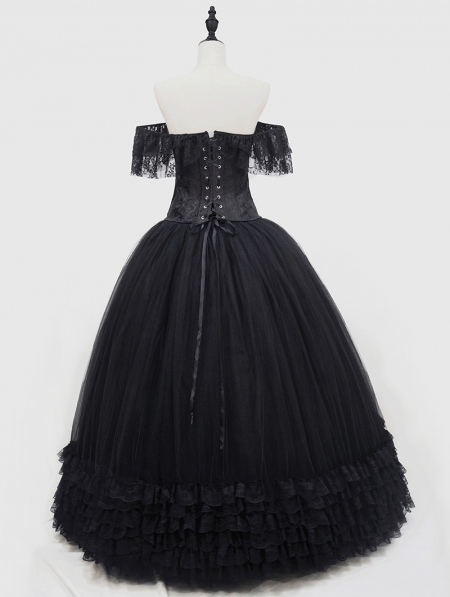
Where is `white background wall`? This screenshot has height=597, width=450. white background wall is located at coordinates (403, 281).